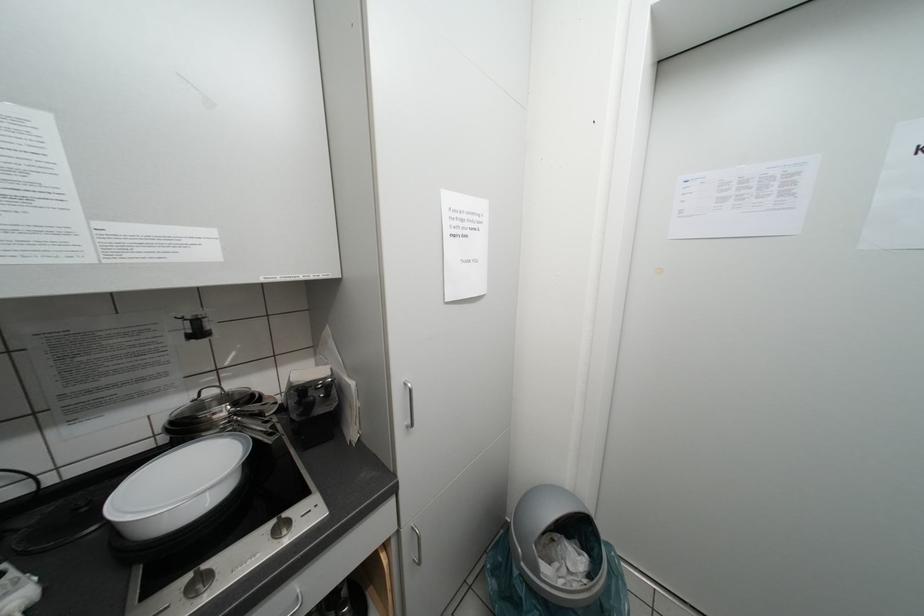
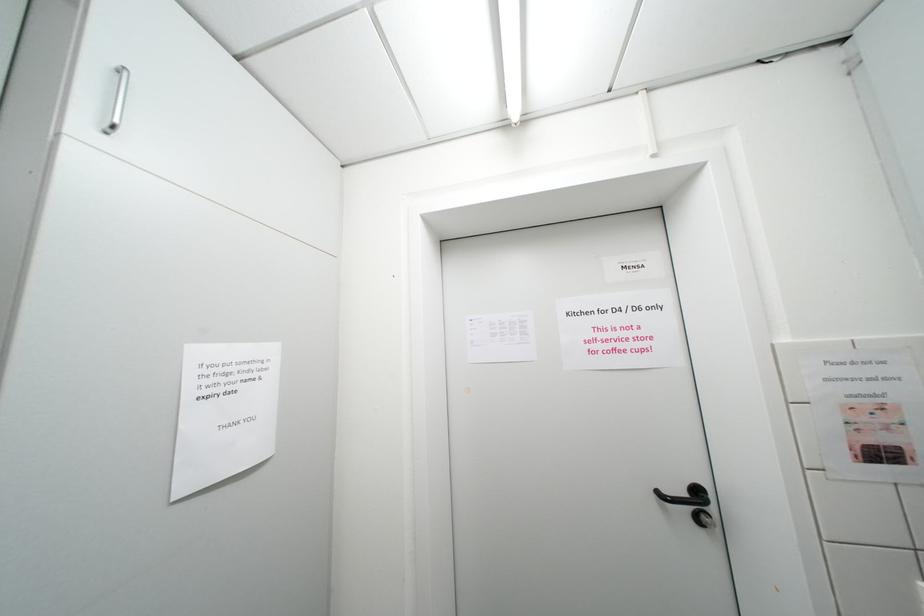
Based on the continuous images, in which direction is the camera rotating?

The camera's rotation is toward right-up.